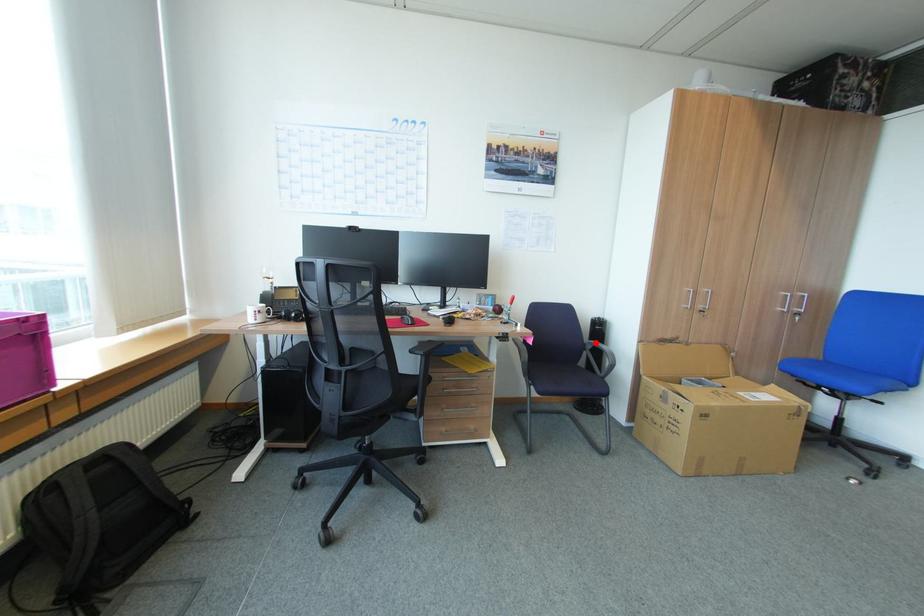
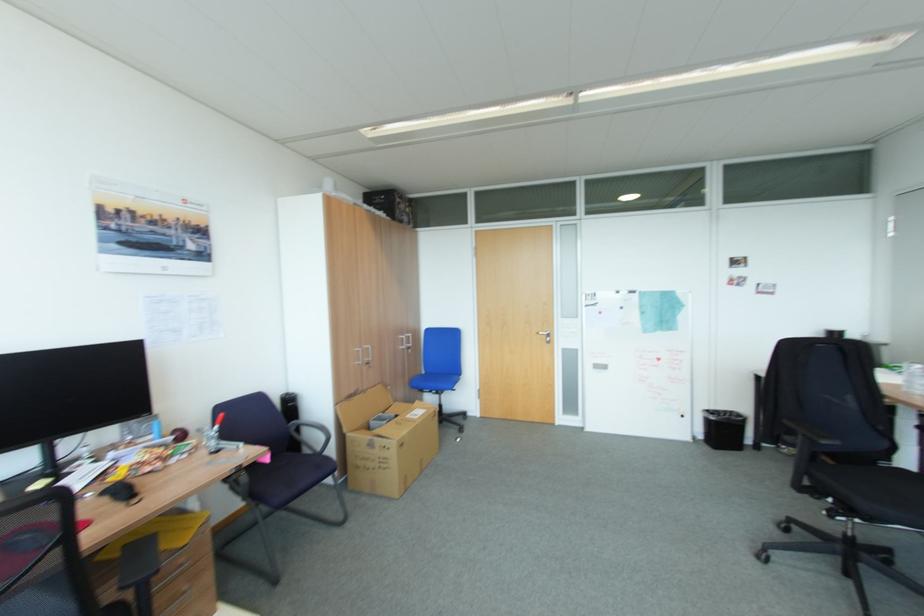
The point at the highlighted location is marked in the first image. Where is the corresponding point in the second image?

(298, 424)